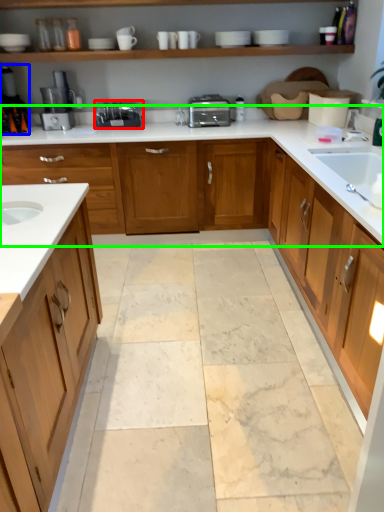
Question: Based on their relative distances, which object is farther from appliance (highlighted by a red box)? Choose from coffee machine (highlighted by a blue box) and countertop (highlighted by a green box).

Choices:
 (A) coffee machine
 (B) countertop

Answer: (A)